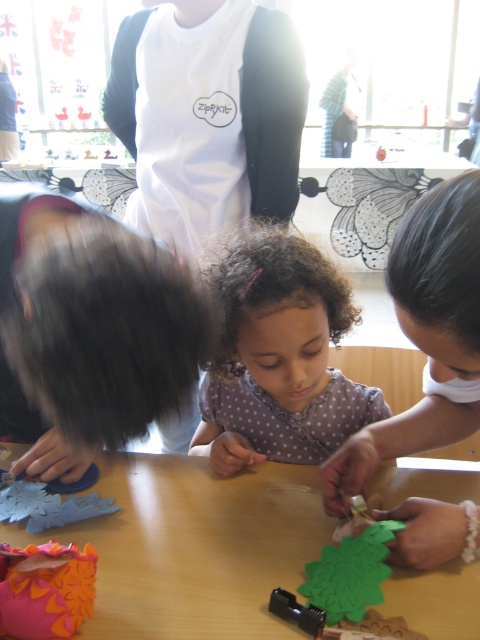
You are a teacher observing the classroom. You notice the wooden table at center and the curly brown hair at center. Which object is taller?

The curly brown hair at center is taller than the wooden table at center.

Looking at this image, you are a photographer trying to capture a closeup shot of the curly brown hair at center and the dark brown smooth hair at upper center. Since you want to focus on both subjects, which hairstyle should you adjust your camera settings for to ensure both fit in the frame?

The curly brown hair at center is wider than the dark brown smooth hair at upper center, so adjust your camera settings to accommodate the wider curly brown hair at center to ensure both fit in the frame.

You are a child participating in the crafting activity. You need to place your craft materials on the wooden table at center. Where exactly should you place them to ensure they are on the table?

The wooden table at center is located at point (x=193, y=547), so you should place your materials at that coordinate to ensure they are on the table.